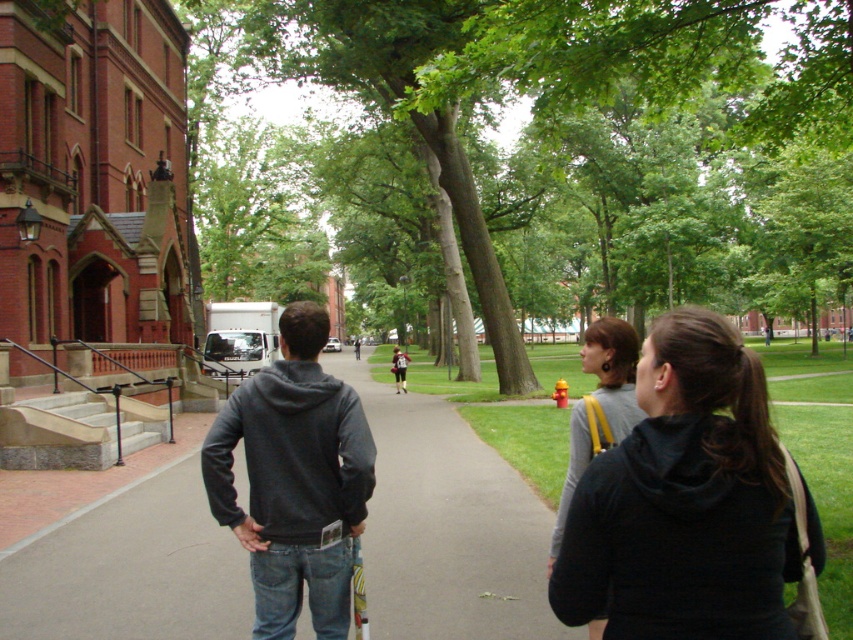
From the picture: What is the color of the pavement at the point marked by coordinates (x=447, y=525)?

The gray asphalt pavement at center is represented by point (x=447, y=525).

You are a delivery person who needs to deliver a package to the red brick building with arched windows. You are standing on the gray asphalt pavement at center and see the dark gray hoodie at center. Which object is smaller in size?

The gray asphalt pavement at center is smaller than the dark gray hoodie at center according to the description provided.